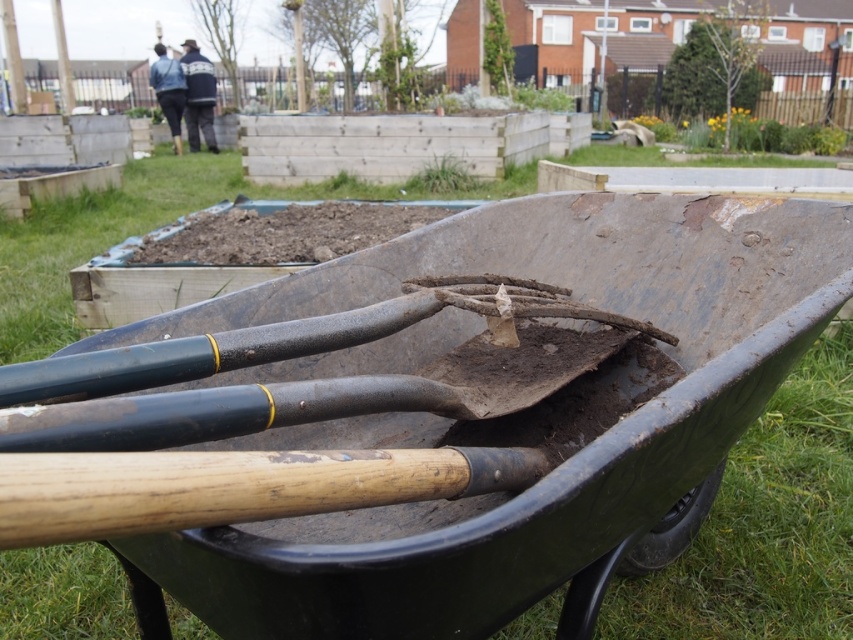
Between green rubber cart at center and brown soil at center, which one is positioned higher?

brown soil at center

Is green rubber cart at center to the right of brown soil at center from the viewer's perspective?

Yes, green rubber cart at center is to the right of brown soil at center.

Measure the distance between green rubber cart at center and camera.

green rubber cart at center and camera are 56.96 centimeters apart from each other.

Where is `green rubber cart at center`? Image resolution: width=853 pixels, height=640 pixels. green rubber cart at center is located at coordinates (461, 406).